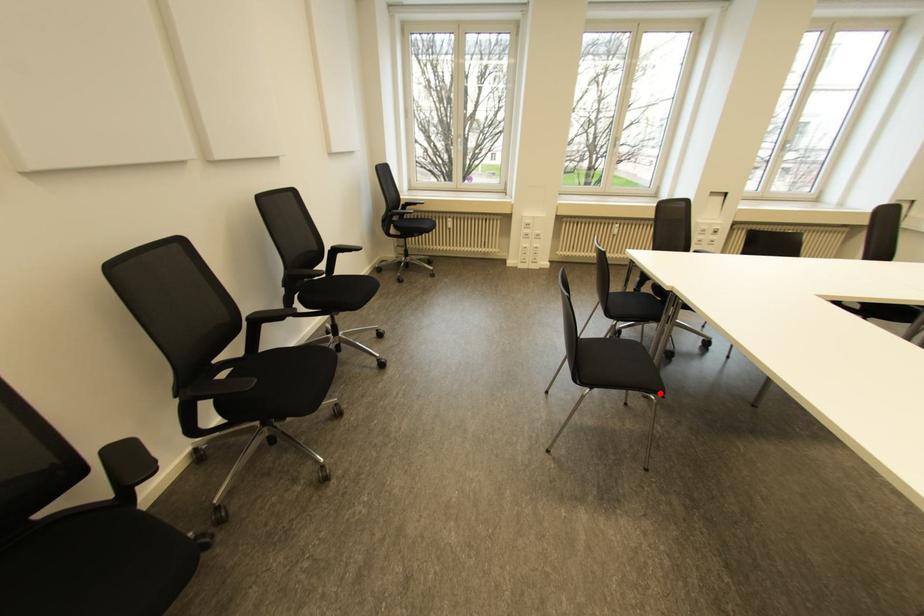
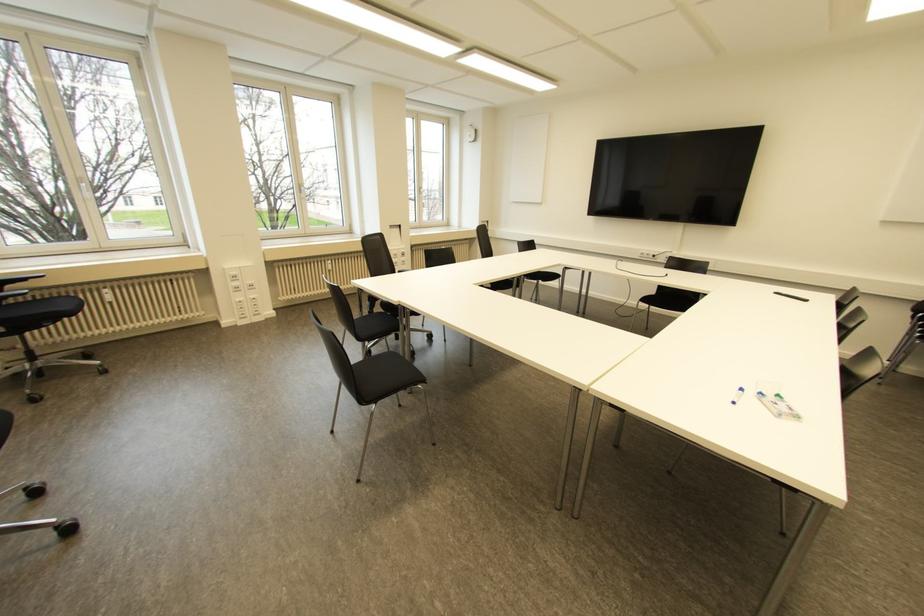
Find the pixel in the second image that matches the highlighted location in the first image.

(422, 381)